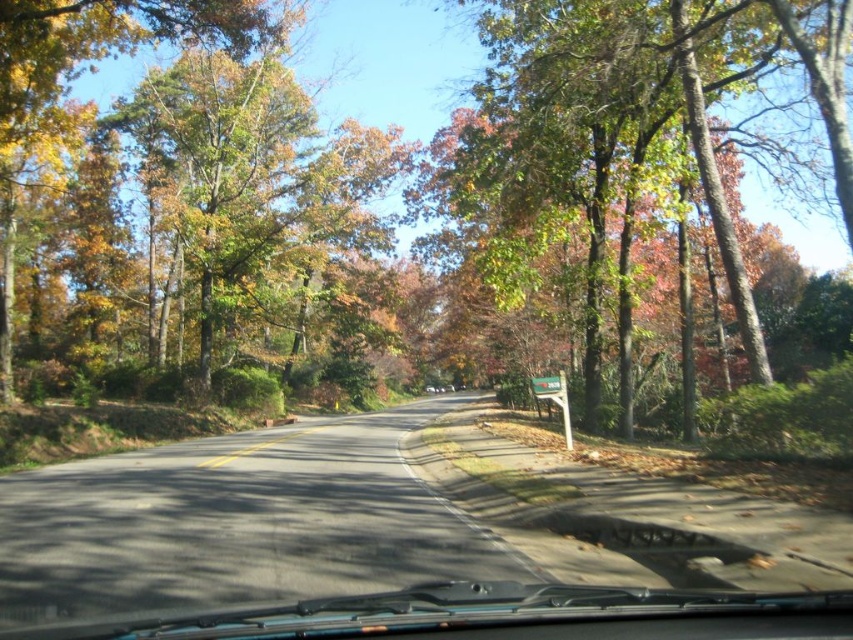
You are a driver approaching the road ahead. You notice a green leafy tree at center and a green plastic sign at center. Which object appears taller from your perspective?

The green leafy tree at center is taller than the green plastic sign at center, so the tree appears taller from your perspective.

You are driving a car and notice a green leafy tree at center and transparent rubber windshield wipers at lower center. How far apart are these two objects from each other?

The distance between the green leafy tree at center and the transparent rubber windshield wipers at lower center is 74.84 meters.